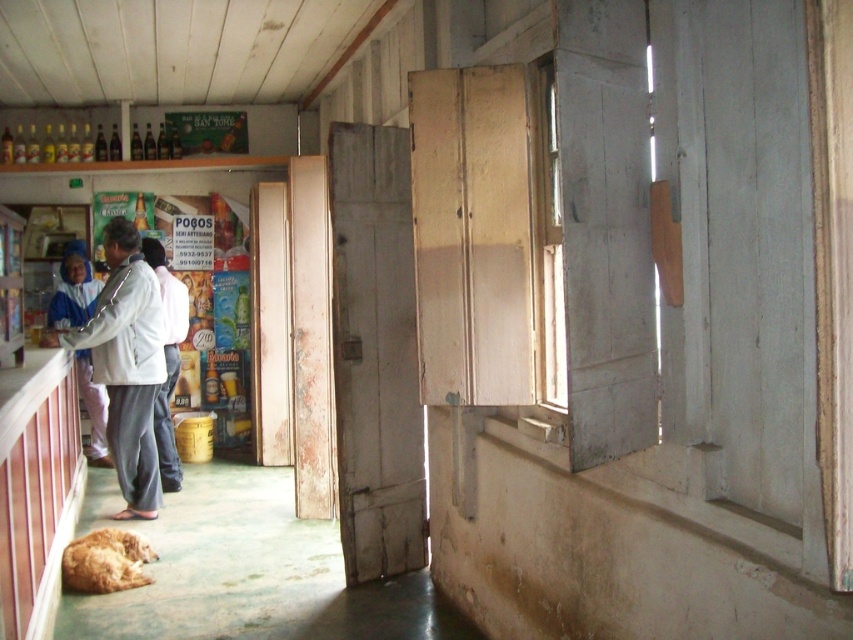
Question: In this image, where is white matte jacket at left located relative to white fabric shirt at center?

Choices:
 (A) right
 (B) left

Answer: (B)

Question: Does white matte jacket at left have a lesser width compared to white fabric shirt at center?

Choices:
 (A) yes
 (B) no

Answer: (B)

Question: Which point is farther to the camera?

Choices:
 (A) (125, 568)
 (B) (167, 364)
 (C) (83, 368)
 (D) (86, 323)

Answer: (C)

Question: Can you confirm if white matte jacket at left is bigger than blue fabric headscarf at left?

Choices:
 (A) yes
 (B) no

Answer: (B)

Question: Which of these objects is positioned farthest from the white fabric shirt at center?

Choices:
 (A) white matte jacket at left
 (B) golden fur dog at lower left
 (C) blue fabric headscarf at left

Answer: (B)

Question: Estimate the real-world distances between objects in this image. Which object is farther from the white fabric shirt at center?

Choices:
 (A) golden fur dog at lower left
 (B) blue fabric headscarf at left

Answer: (A)